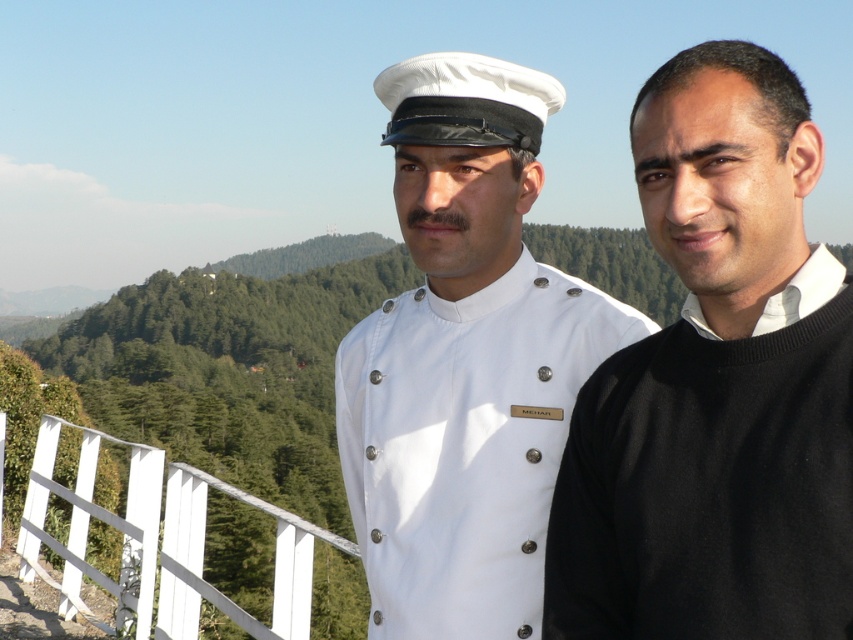
Question: Can you confirm if white uniform at center is positioned to the right of black wool sweater at right?

Choices:
 (A) yes
 (B) no

Answer: (B)

Question: Which is nearer to the white wooden fence at lower left?

Choices:
 (A) white uniform at center
 (B) black wool sweater at right

Answer: (A)

Question: Is black wool sweater at right smaller than white wooden fence at lower left?

Choices:
 (A) yes
 (B) no

Answer: (A)

Question: Which object is farther from the camera taking this photo?

Choices:
 (A) white wooden fence at lower left
 (B) white uniform at center
 (C) black wool sweater at right

Answer: (A)

Question: Considering the relative positions of black wool sweater at right and white wooden fence at lower left in the image provided, where is black wool sweater at right located with respect to white wooden fence at lower left?

Choices:
 (A) right
 (B) left

Answer: (A)

Question: Among these objects, which one is nearest to the camera?

Choices:
 (A) white uniform at center
 (B) black wool sweater at right

Answer: (A)